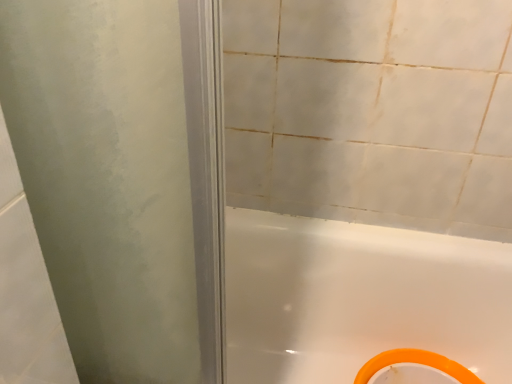
Question: Is white glossy bathtub at lower right taller or shorter than orange rubber ring at bottom right?

Choices:
 (A) tall
 (B) short

Answer: (A)

Question: Considering the positions of white glossy bathtub at lower right and orange rubber ring at bottom right in the image, is white glossy bathtub at lower right bigger or smaller than orange rubber ring at bottom right?

Choices:
 (A) small
 (B) big

Answer: (B)

Question: From a real-world perspective, is white glossy bathtub at lower right physically located above or below orange rubber ring at bottom right?

Choices:
 (A) above
 (B) below

Answer: (A)

Question: In the image, is orange rubber ring at bottom right positioned in front of or behind white glossy bathtub at lower right?

Choices:
 (A) front
 (B) behind

Answer: (B)

Question: In terms of size, does orange rubber ring at bottom right appear bigger or smaller than white glossy bathtub at lower right?

Choices:
 (A) big
 (B) small

Answer: (B)

Question: Is orange rubber ring at bottom right to the left or to the right of white glossy bathtub at lower right in the image?

Choices:
 (A) right
 (B) left

Answer: (A)

Question: From a real-world perspective, is orange rubber ring at bottom right physically located above or below white glossy bathtub at lower right?

Choices:
 (A) above
 (B) below

Answer: (B)